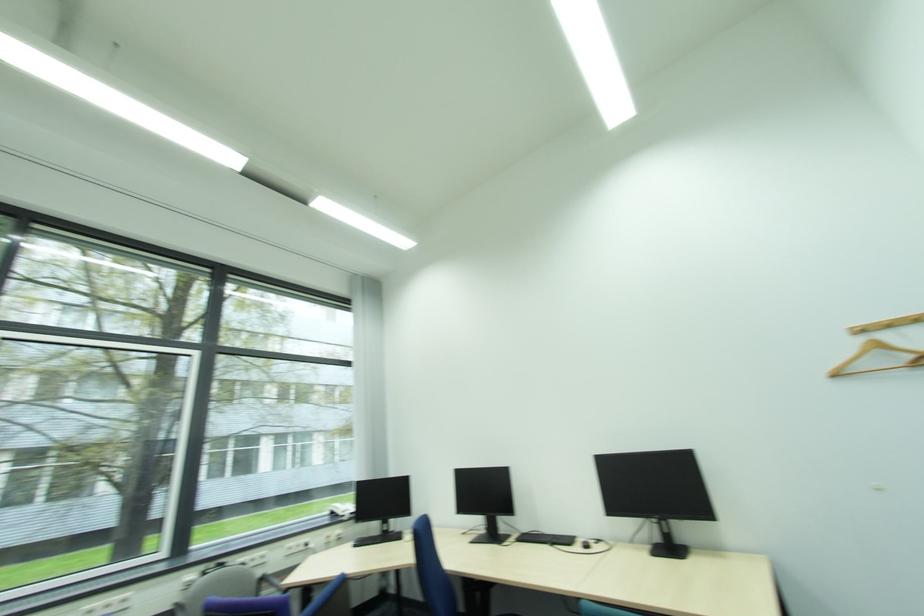
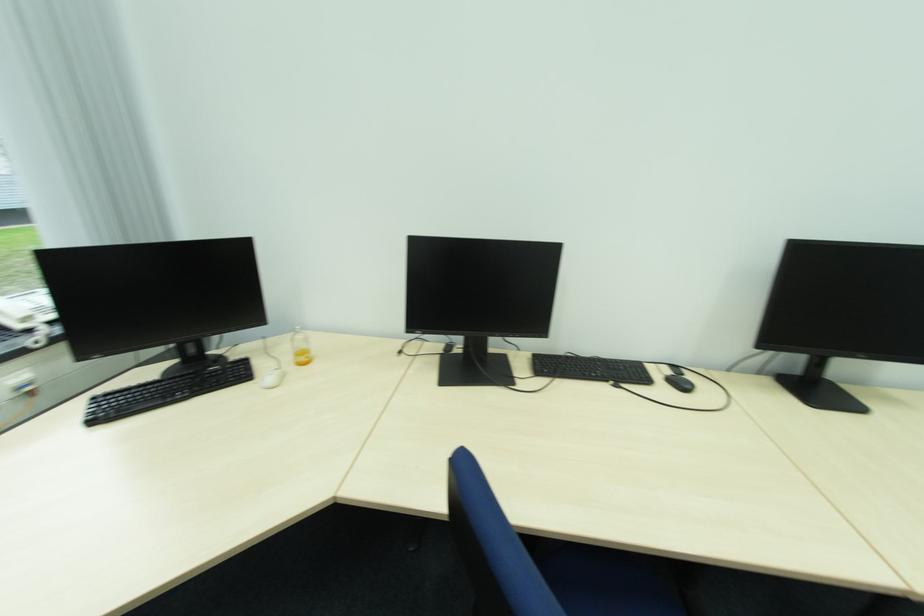
Where in the second image is the point corresponding to [360,546] from the first image?

(100, 422)